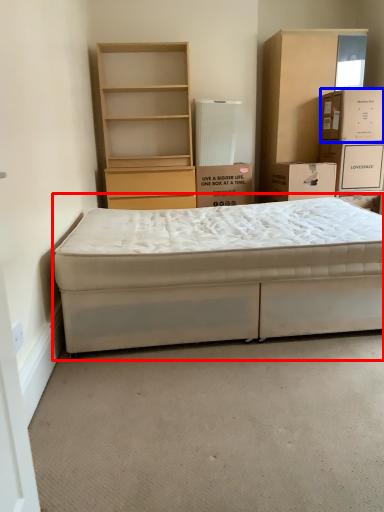
Question: Which of the following is the closest to the observer, bed (highlighted by a red box) or box (highlighted by a blue box)?

Choices:
 (A) bed
 (B) box

Answer: (A)